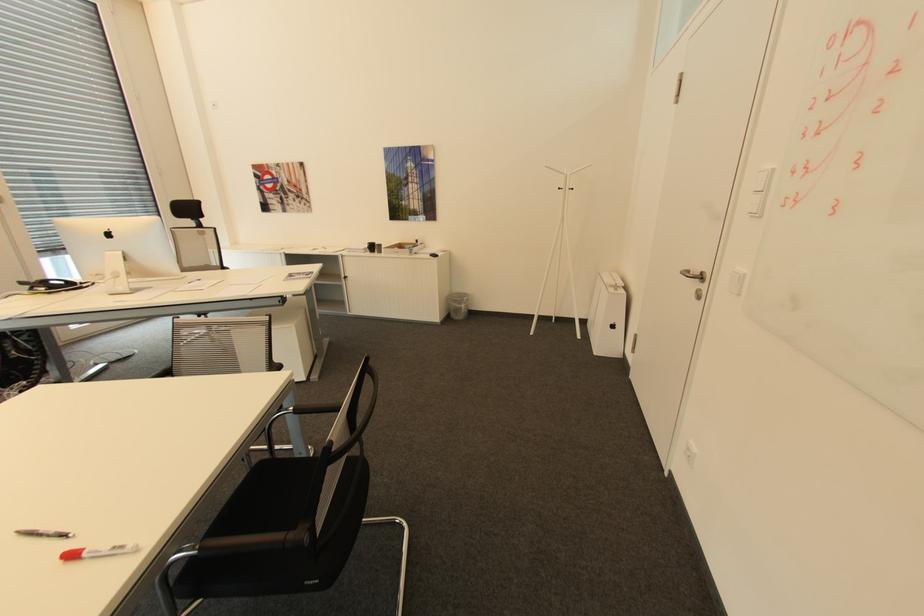
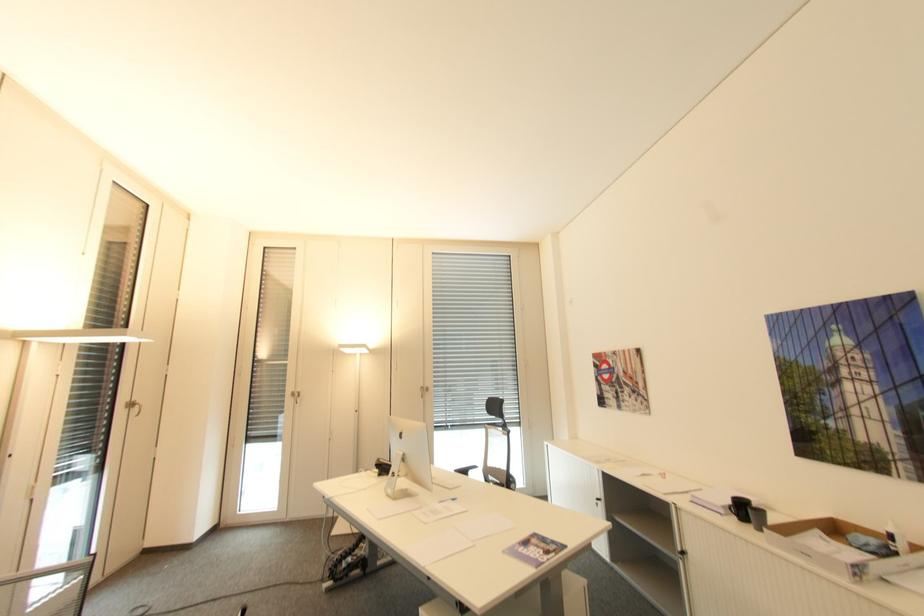
Where in the second image is the point corresponding to [420,240] from the first image?

(895, 537)